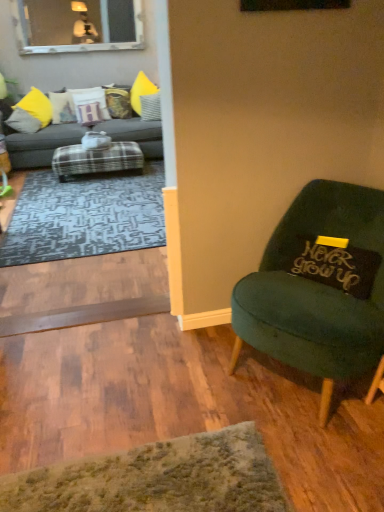
The height and width of the screenshot is (512, 384). Describe the element at coordinates (319, 287) in the screenshot. I see `velvet green chair at right` at that location.

The width and height of the screenshot is (384, 512). Describe the element at coordinates (150, 106) in the screenshot. I see `white fabric pillow at upper center, the fifth pillow positioned from the left` at that location.

Find the location of a particular element. The image size is (384, 512). black fabric pillow at right, arranged as the sixth pillow when viewed from the back is located at coordinates (334, 264).

In order to face velvet yellow pillow at center, the 3th pillow from the right, should I rotate leftwards or rightwards?

Turn left approximately 9.700 degrees to face it.

Where is `plush purple pillow at upper left, placed as the third pillow when sorted from top to bottom`? plush purple pillow at upper left, placed as the third pillow when sorted from top to bottom is located at coordinates (89, 105).

Does velvet green chair at right have a larger size compared to plush purple pillow at upper left, positioned as the 4th pillow in right-to-left order?

Indeed, velvet green chair at right has a larger size compared to plush purple pillow at upper left, positioned as the 4th pillow in right-to-left order.

Is velvet green chair at right looking in the opposite direction of plush purple pillow at upper left, which ranks as the 4th pillow in bottom-to-top order?

velvet green chair at right is not turned away from plush purple pillow at upper left, which ranks as the 4th pillow in bottom-to-top order.

From the image's perspective, which is below, velvet green chair at right or plush purple pillow at upper left, positioned as the 4th pillow in right-to-left order?

velvet green chair at right.

Is plaid fabric ottoman at center located outside velvet green chair at right?

Indeed, plaid fabric ottoman at center is completely outside velvet green chair at right.

Considering the relative positions of plaid fabric ottoman at center and velvet green chair at right in the image provided, is plaid fabric ottoman at center behind velvet green chair at right?

That is True.

Locate an element on the screen. chair that appears on the right of plaid fabric ottoman at center is located at coordinates (319, 287).

Considering the relative positions of plaid fabric ottoman at center and velvet green chair at right in the image provided, is plaid fabric ottoman at center to the right of velvet green chair at right from the viewer's perspective?

No.

Is matte yellow pillow at upper left, the 5th pillow from the right, thinner than plush purple pillow at upper left, positioned as the 4th pillow in right-to-left order?

Yes.

In the scene shown: Does matte yellow pillow at upper left, the 3th pillow viewed from the back, have a greater height compared to plush purple pillow at upper left, placed as the third pillow when sorted from top to bottom?

Yes, matte yellow pillow at upper left, the 3th pillow viewed from the back, is taller than plush purple pillow at upper left, placed as the third pillow when sorted from top to bottom.

Starting from the matte yellow pillow at upper left, the 3th pillow viewed from the back, which pillow is the 1st one behind? Please provide its 2D coordinates.

[(89, 105)]

Is velvet green chair at right in front of or behind black fabric pillow at right, which is the 6th pillow from top to bottom, in the image?

In the image, velvet green chair at right appears in front of black fabric pillow at right, which is the 6th pillow from top to bottom.

Does velvet green chair at right turn towards black fabric pillow at right, which is counted as the 1th pillow, starting from the bottom?

Yes, velvet green chair at right faces towards black fabric pillow at right, which is counted as the 1th pillow, starting from the bottom.

Is velvet green chair at right thinner than black fabric pillow at right, arranged as the 1th pillow when viewed from the front?

No.

From the image's perspective, is velvet green chair at right beneath black fabric pillow at right, which is the 6th pillow from top to bottom?

Yes, from the image's perspective, velvet green chair at right is below black fabric pillow at right, which is the 6th pillow from top to bottom.

Considering the points (134, 162) and (33, 120), which point is in front, point (134, 162) or point (33, 120)?

The point (134, 162) is closer to the camera.

Does plaid fabric ottoman at center come behind gray fabric couch at left?

No, it is in front of gray fabric couch at left.

From a real-world perspective, is plaid fabric ottoman at center physically located above or below gray fabric couch at left?

From a real-world perspective, plaid fabric ottoman at center is physically below gray fabric couch at left.

Does plaid fabric ottoman at center appear on the right side of gray fabric couch at left?

Indeed, plaid fabric ottoman at center is positioned on the right side of gray fabric couch at left.

Is point (132, 44) farther from viewer compared to point (52, 102)?

Yes.

Is clear glass window at upper left wider or thinner than matte yellow pillow at upper left, the 5th pillow from the right?

Clearly, clear glass window at upper left has less width compared to matte yellow pillow at upper left, the 5th pillow from the right.

How far apart are clear glass window at upper left and matte yellow pillow at upper left, the second pillow in the left-to-right sequence?

clear glass window at upper left and matte yellow pillow at upper left, the second pillow in the left-to-right sequence, are 3.47 feet apart from each other.

Which of these two, clear glass window at upper left or matte yellow pillow at upper left, placed as the fourth pillow when sorted from front to back, is bigger?

With larger size is clear glass window at upper left.

Does gray fabric couch at left turn towards matte yellow pillow at left, which ranks as the sixth pillow in right-to-left order?

Yes.

Would you say matte yellow pillow at left, which ranks as the sixth pillow in right-to-left order, is part of gray fabric couch at left's contents?

That's correct, matte yellow pillow at left, which ranks as the sixth pillow in right-to-left order, is inside gray fabric couch at left.

In the scene shown: Considering the sizes of gray fabric couch at left and matte yellow pillow at left, acting as the 5th pillow starting from the top, in the image, is gray fabric couch at left taller or shorter than matte yellow pillow at left, acting as the 5th pillow starting from the top,?

Clearly, gray fabric couch at left is taller compared to matte yellow pillow at left, acting as the 5th pillow starting from the top.

This screenshot has width=384, height=512. Find the location of `studio couch lying in front of the matte yellow pillow at left, acting as the 5th pillow starting from the top`. studio couch lying in front of the matte yellow pillow at left, acting as the 5th pillow starting from the top is located at coordinates point(44,138).

Starting from the velvet green chair at right, which pillow is the 5th one behind? Please provide its 2D coordinates.

[(89, 105)]

Find the location of a particular element. table that is under the velvet green chair at right (from a real-world perspective) is located at coordinates (97, 159).

Based on their spatial positions, is white fabric pillow at upper center, the 2th pillow from the right, or gray fabric couch at left further from matte yellow pillow at left, acting as the 5th pillow starting from the top?

white fabric pillow at upper center, the 2th pillow from the right.

Based on their spatial positions, is plaid fabric ottoman at center or plush purple pillow at upper left, placed as the third pillow when sorted from top to bottom, further from velvet green chair at right?

plush purple pillow at upper left, placed as the third pillow when sorted from top to bottom.

Based on their spatial positions, is gray fabric couch at left or velvet green chair at right further from plaid fabric ottoman at center?

Among the two, velvet green chair at right is located further to plaid fabric ottoman at center.

From the image, which object appears to be farther from matte yellow pillow at upper left, the 2th pillow viewed from the top, clear glass window at upper left or black fabric pillow at right, which is the 6th pillow from top to bottom?

black fabric pillow at right, which is the 6th pillow from top to bottom, is further to matte yellow pillow at upper left, the 2th pillow viewed from the top.

Based on the photo, based on their spatial positions, is plush purple pillow at upper left, which ranks as the 2th pillow in back-to-front order, or matte yellow pillow at left, which ranks as the sixth pillow in right-to-left order, further from velvet yellow pillow at center, the first pillow from the top?

The object further to velvet yellow pillow at center, the first pillow from the top, is matte yellow pillow at left, which ranks as the sixth pillow in right-to-left order.

Looking at the image, which one is located further to plush purple pillow at upper left, positioned as the 4th pillow in right-to-left order, matte yellow pillow at upper left, the second pillow in the left-to-right sequence, or clear glass window at upper left?

Based on the image, clear glass window at upper left appears to be further to plush purple pillow at upper left, positioned as the 4th pillow in right-to-left order.

Estimate the real-world distances between objects in this image. Which object is closer to plaid fabric ottoman at center, black fabric pillow at right, which is counted as the 1th pillow, starting from the bottom, or velvet yellow pillow at center, which is counted as the fourth pillow, starting from the left?

The object closer to plaid fabric ottoman at center is velvet yellow pillow at center, which is counted as the fourth pillow, starting from the left.

Based on their spatial positions, is black fabric pillow at right, arranged as the sixth pillow when viewed from the back, or plaid fabric ottoman at center closer to white fabric pillow at upper center, placed as the third pillow when sorted from bottom to top?

Based on the image, plaid fabric ottoman at center appears to be nearer to white fabric pillow at upper center, placed as the third pillow when sorted from bottom to top.

Locate an element on the screen. table between velvet green chair at right and matte yellow pillow at left, acting as the 5th pillow starting from the top, along the z-axis is located at coordinates (97, 159).

Where is `glass door between black fabric pillow at right, which is the 6th pillow in left-to-right order, and matte yellow pillow at upper left, the 5th pillow from the right, in the front-back direction`? Image resolution: width=384 pixels, height=512 pixels. glass door between black fabric pillow at right, which is the 6th pillow in left-to-right order, and matte yellow pillow at upper left, the 5th pillow from the right, in the front-back direction is located at coordinates (79, 25).

This screenshot has width=384, height=512. I want to click on table positioned between black fabric pillow at right, arranged as the 1th pillow when viewed from the front, and matte yellow pillow at upper left, which is the 5th pillow in bottom-to-top order, from near to far, so coord(97,159).

The image size is (384, 512). What are the coordinates of `pillow located between plush purple pillow at upper left, which ranks as the 2th pillow in back-to-front order, and white fabric pillow at upper center, placed as the third pillow when sorted from bottom to top, in the left-right direction` in the screenshot? It's located at (118, 102).